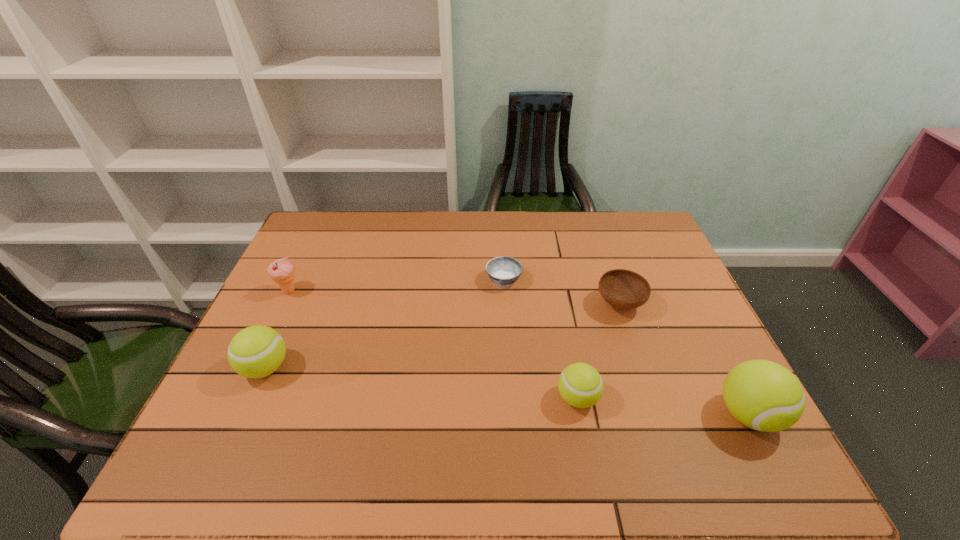
I want to click on free region located on the right of the leftmost tennis ball, so click(x=348, y=368).

Identify the location of free space located 0.280m on the right of the third object from right to left. (720, 398).

Find the location of a particular element. Image resolution: width=960 pixels, height=540 pixels. free space located 0.320m on the left of the tallest tennis ball is located at coordinates (573, 415).

Locate an element on the screen. Image resolution: width=960 pixels, height=540 pixels. vacant position located on the right of the ashtray is located at coordinates (621, 280).

At what (x,y) coordinates should I click in order to perform the action: click on vacant space situated on the right of the icecream. Please return your answer as a coordinate pair (x, y). Looking at the image, I should click on (342, 291).

I want to click on vacant space located on the front of the bowl, so click(x=652, y=397).

The width and height of the screenshot is (960, 540). Find the location of `tennis ball located at the left edge`. tennis ball located at the left edge is located at coordinates (257, 351).

Locate an element on the screen. icecream that is at the left edge is located at coordinates point(282,271).

Locate an element on the screen. tennis ball present at the right edge is located at coordinates (765, 396).

Locate an element on the screen. The height and width of the screenshot is (540, 960). bowl present at the right edge is located at coordinates point(623,289).